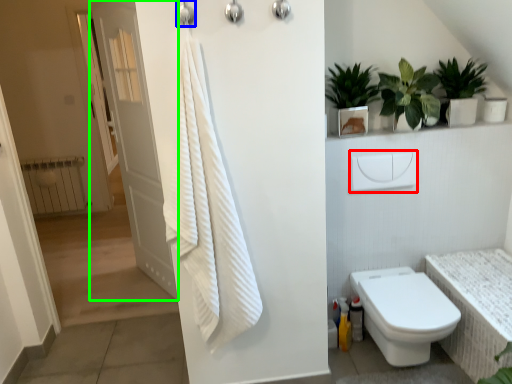
Question: Which object is positioned closest to towel bar (highlighted by a red box)? Select from shower (highlighted by a blue box) and door (highlighted by a green box).

Choices:
 (A) shower
 (B) door

Answer: (A)